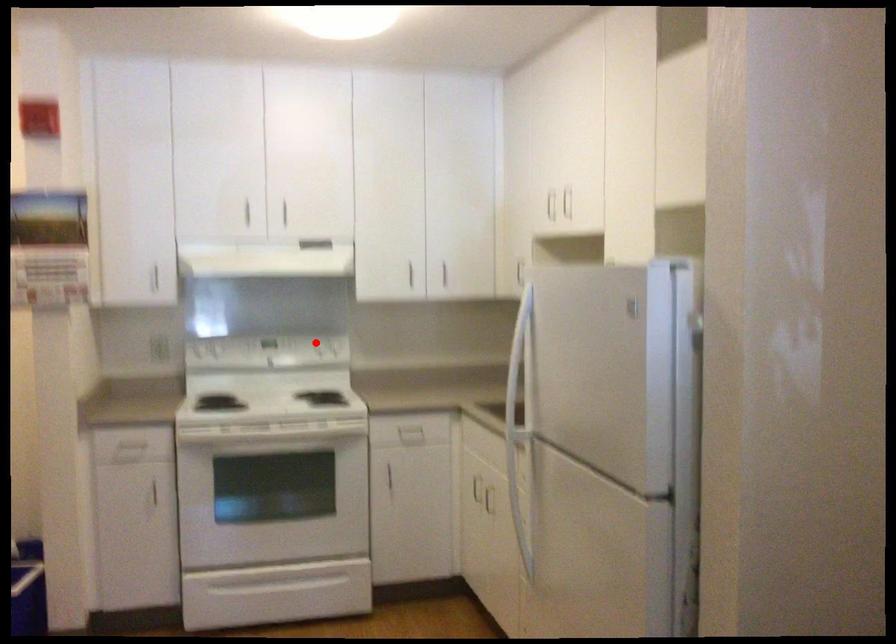
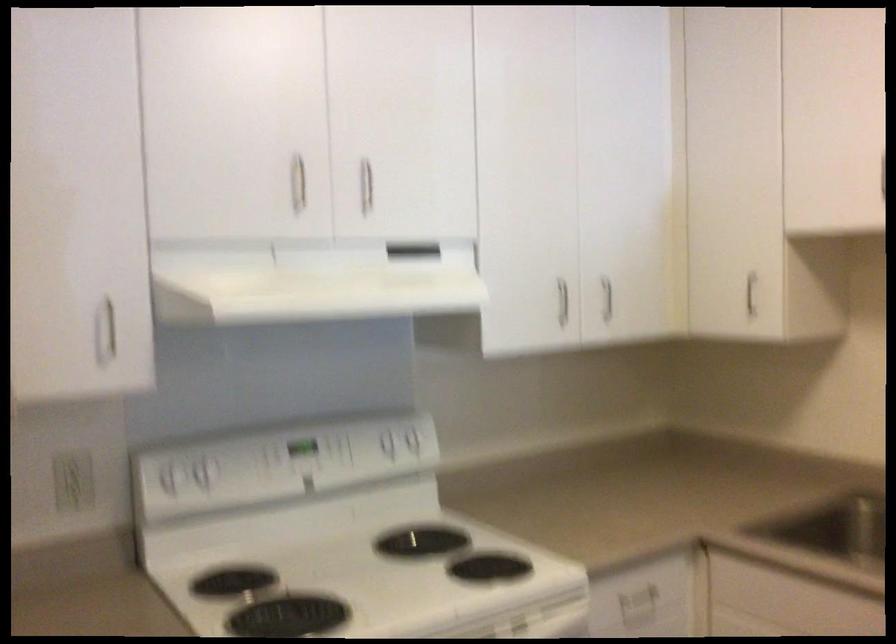
Where in the second image is the point corresponding to the highlighted location from the first image?

(385, 440)